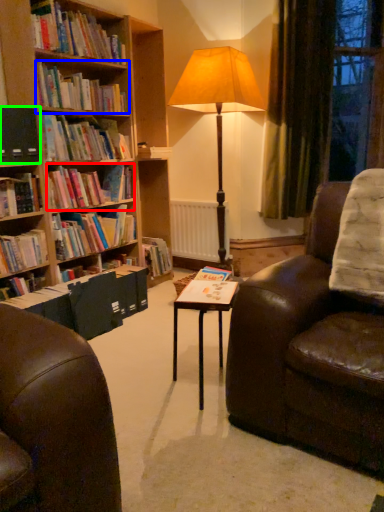
Question: Considering the real-world distances, which object is closest to book (highlighted by a red box)? book (highlighted by a blue box) or paperback book (highlighted by a green box).

Choices:
 (A) book
 (B) paperback book

Answer: (B)